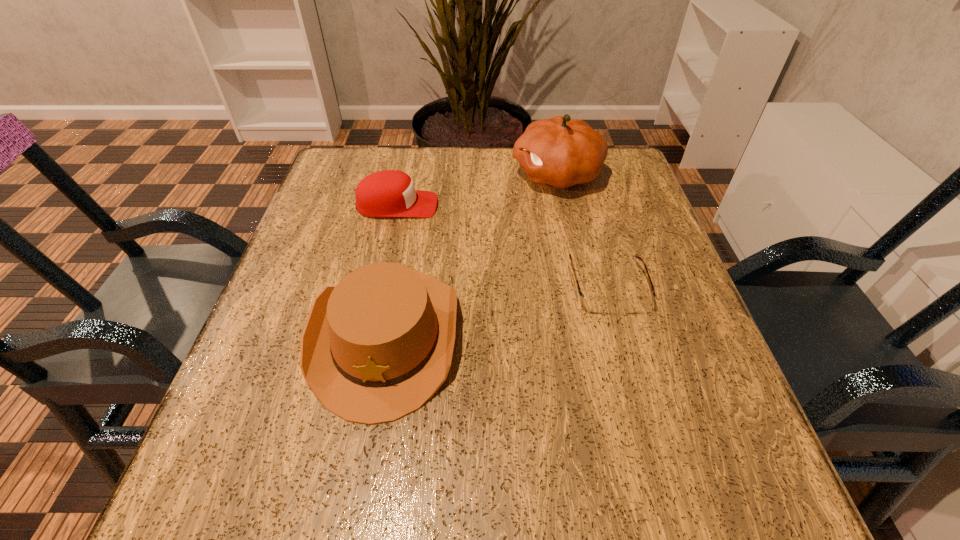
Locate an element on the screen. the tallest object is located at coordinates (560, 151).

Find the location of a particular element. This screenshot has height=540, width=960. cowboy hat is located at coordinates (376, 347).

The height and width of the screenshot is (540, 960). I want to click on the third tallest object, so click(389, 193).

The image size is (960, 540). I want to click on the shortest object, so click(592, 304).

What are the coordinates of `free spot located 0.090m on the front face of the pumpkin` in the screenshot? It's located at (475, 174).

Locate an element on the screen. The width and height of the screenshot is (960, 540). blank area located on the front face of the pumpkin is located at coordinates (407, 174).

The width and height of the screenshot is (960, 540). I want to click on vacant space situated 0.070m on the front face of the pumpkin, so point(483,174).

In order to click on vacant region located 0.110m on the front-facing side of the third shortest object in this screenshot , I will do `click(355, 506)`.

Image resolution: width=960 pixels, height=540 pixels. I want to click on free space located 0.260m on the front-facing side of the second shortest object, so click(x=550, y=205).

Locate an element on the screen. The image size is (960, 540). free point located 0.140m on the front-facing side of the shortest object is located at coordinates (634, 385).